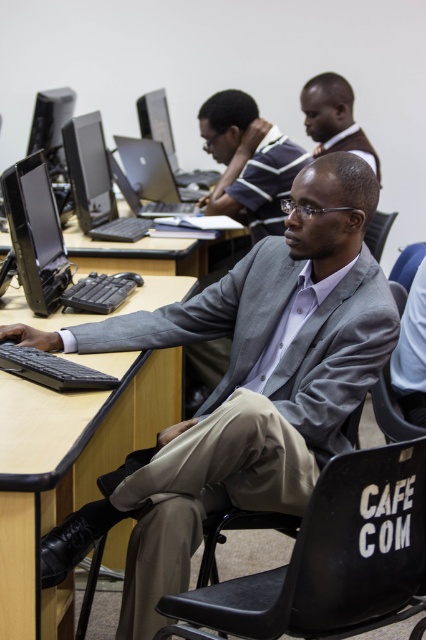
You are standing in the computer lab and want to move from point A to point B. Point A is located at coordinates point (215, 520) and point B is at point (166, 115). According to the scene description, which direction should you move to go from point A to point B?

To move from point A to point B, you should move backward since point A is in front of point B.

You are a visitor in this computer lab and want to sit down at the desk with the satin black monitor at upper center. Which side of the monitor should you approach to find the black plastic chair at lower center?

The black plastic chair at lower center is to the right of the satin black monitor at upper center, so you should approach the right side of the monitor to find the chair.

You are a photographer standing in the classroom and want to capture a photo that includes both the gray suit at center and the black plastic chair at lower center. Given their sizes, which object will appear bigger in the photo?

The gray suit at center will appear bigger in the photo because it has a larger size compared to the black plastic chair at lower center.